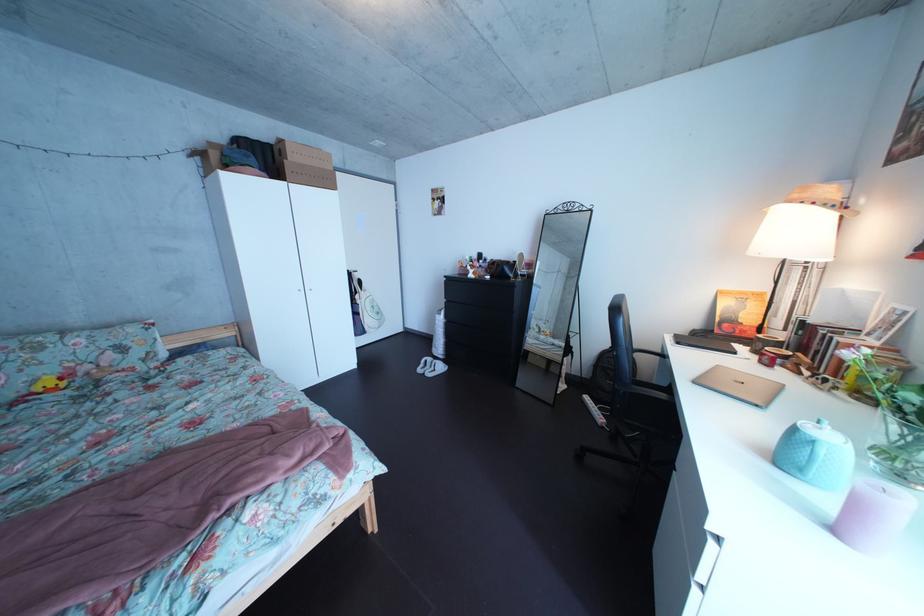
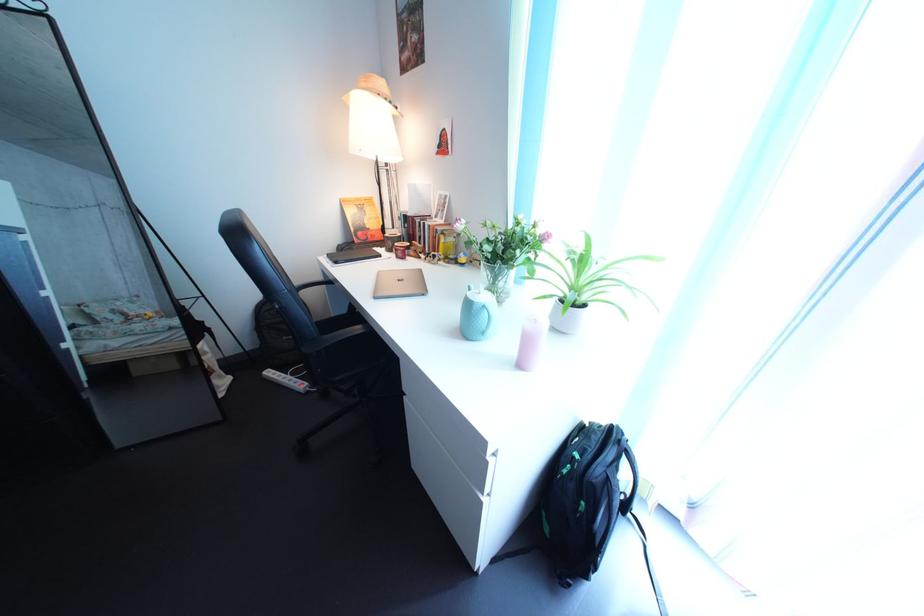
In the second image, find the point that corresponds to the point at 601,406 in the first image.

(284, 381)